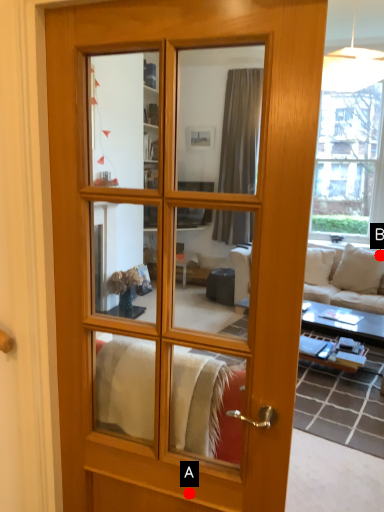
Question: Two points are circled on the image, labeled by A and B beside each circle. Which point is further to the camera?

Choices:
 (A) A is further
 (B) B is further

Answer: (B)